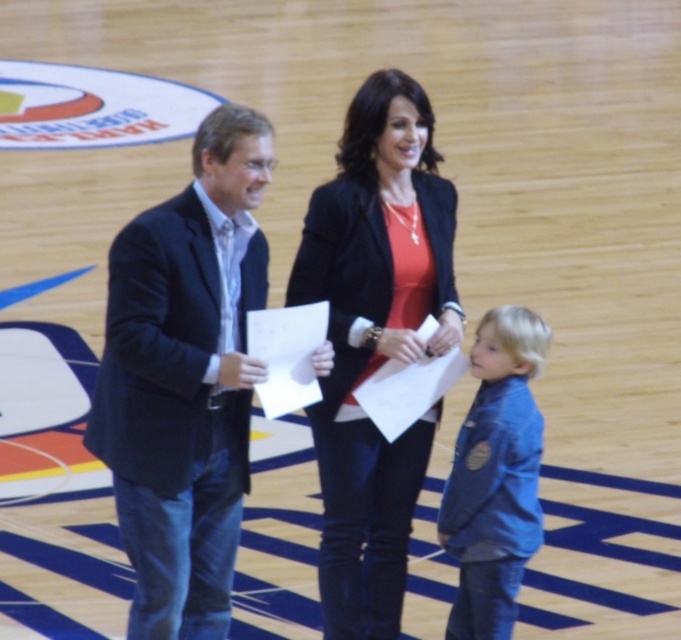
Looking at this image, does matte black suit at left lie behind dark blue textured suit at left?

Yes, it is.

Can you confirm if matte black suit at left is positioned below dark blue textured suit at left?

Incorrect, matte black suit at left is not positioned below dark blue textured suit at left.

Does point (308, 252) come farther from viewer compared to point (208, 467)?

Yes.

Locate an element on the screen. This screenshot has height=640, width=681. matte black suit at left is located at coordinates (375, 340).

Who is more forward, (375, 358) or (161, 584)?

Positioned in front is point (161, 584).

Is matte black blazer at center below dark blue textured suit at left?

No.

I want to click on matte black blazer at center, so click(x=375, y=340).

Find the location of `matte black blazer at center`. matte black blazer at center is located at coordinates (375, 340).

Which is above, matte black blazer at center or denim jacket at lower right?

matte black blazer at center is higher up.

Does point (364, 141) come in front of point (445, 628)?

Yes, point (364, 141) is closer to viewer.

Does point (330, 451) come behind point (516, 493)?

Yes, it is behind point (516, 493).

Find the location of a particular element. Image resolution: width=681 pixels, height=640 pixels. matte black blazer at center is located at coordinates (375, 340).